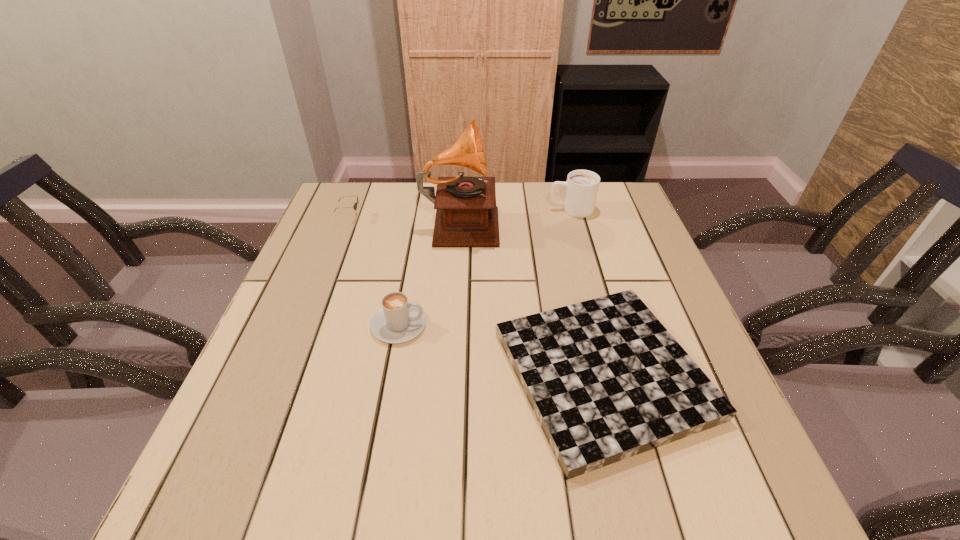
Locate an element on the screen. This screenshot has width=960, height=540. the tallest object is located at coordinates (466, 213).

Where is `the taller cappuccino`? the taller cappuccino is located at coordinates (582, 186).

The height and width of the screenshot is (540, 960). Identify the location of the right cappuccino. (582, 186).

In order to click on the nearer cappuccino in this screenshot , I will do `click(398, 321)`.

The height and width of the screenshot is (540, 960). I want to click on the left cappuccino, so click(x=398, y=321).

This screenshot has height=540, width=960. What are the coordinates of `the leftmost object` in the screenshot? It's located at (355, 205).

Image resolution: width=960 pixels, height=540 pixels. I want to click on the shortest object, so click(606, 380).

I want to click on vacant space located on the horn of the phonograph record, so click(x=554, y=220).

What are the coordinates of `free spot located 0.250m on the side with the handle of the taller cappuccino` in the screenshot? It's located at (465, 210).

What are the coordinates of `free region located 0.340m on the side with the handle of the taller cappuccino` in the screenshot? It's located at (435, 210).